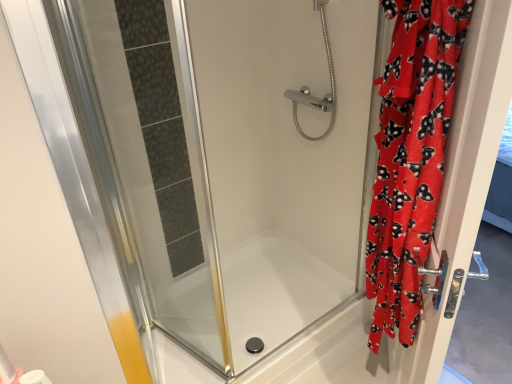
Question: Considering the relative positions of velvet red robe at right, which is the second screen door in left-to-right order, and chrome metallic showerhead at upper center in the image provided, is velvet red robe at right, which is the second screen door in left-to-right order, to the left of chrome metallic showerhead at upper center from the viewer's perspective?

Choices:
 (A) yes
 (B) no

Answer: (B)

Question: From the image's perspective, is velvet red robe at right, which appears as the first screen door when viewed from the right, under chrome metallic showerhead at upper center?

Choices:
 (A) no
 (B) yes

Answer: (B)

Question: From a real-world perspective, is velvet red robe at right, which is the second screen door in left-to-right order, on top of chrome metallic showerhead at upper center?

Choices:
 (A) yes
 (B) no

Answer: (B)

Question: Can you confirm if velvet red robe at right, which appears as the first screen door when viewed from the right, is taller than chrome metallic showerhead at upper center?

Choices:
 (A) no
 (B) yes

Answer: (B)

Question: Can you confirm if velvet red robe at right, which appears as the first screen door when viewed from the right, is bigger than chrome metallic showerhead at upper center?

Choices:
 (A) no
 (B) yes

Answer: (B)

Question: Can chrome metallic showerhead at upper center be found inside velvet red robe at right, which appears as the first screen door when viewed from the right?

Choices:
 (A) yes
 (B) no

Answer: (B)

Question: Is white matte toilet paper at lower left aimed at red velvet curtain at right?

Choices:
 (A) no
 (B) yes

Answer: (A)

Question: Considering the relative positions of white matte toilet paper at lower left and red velvet curtain at right in the image provided, is white matte toilet paper at lower left to the right of red velvet curtain at right from the viewer's perspective?

Choices:
 (A) yes
 (B) no

Answer: (B)

Question: Is white matte toilet paper at lower left closer to camera compared to red velvet curtain at right?

Choices:
 (A) yes
 (B) no

Answer: (B)

Question: From the image's perspective, is white matte toilet paper at lower left beneath red velvet curtain at right?

Choices:
 (A) yes
 (B) no

Answer: (A)

Question: Is the position of white matte toilet paper at lower left more distant than that of red velvet curtain at right?

Choices:
 (A) yes
 (B) no

Answer: (A)

Question: Is red velvet curtain at right at the back of white matte toilet paper at lower left?

Choices:
 (A) no
 (B) yes

Answer: (A)

Question: Is transparent glass bathtub at center wider than white matte toilet paper at lower left?

Choices:
 (A) yes
 (B) no

Answer: (A)